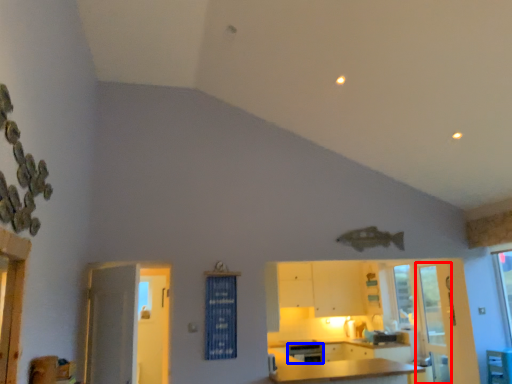
Question: Which of the following is the farthest to the observer, screen door (highlighted by a red box) or dish washer (highlighted by a blue box)?

Choices:
 (A) screen door
 (B) dish washer

Answer: (B)